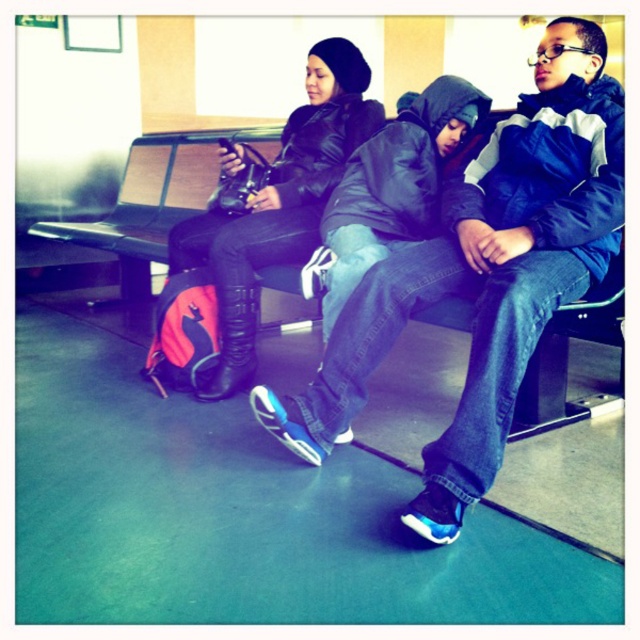
Is point (337, 406) farther from viewer compared to point (136, 150)?

That is False.

What do you see at coordinates (484, 275) in the screenshot? I see `blue suede sneakers at center` at bounding box center [484, 275].

Is point (509, 204) positioned behind point (120, 198)?

No, (509, 204) is closer to viewer.

This screenshot has width=640, height=640. In order to click on blue suede sneakers at center in this screenshot , I will do `click(484, 275)`.

Does black leather jacket at center have a lesser height compared to metallic gray bench at center?

No, black leather jacket at center is not shorter than metallic gray bench at center.

This screenshot has height=640, width=640. I want to click on black leather jacket at center, so click(278, 204).

Where is `black leather jacket at center`? black leather jacket at center is located at coordinates (278, 204).

Does blue suede sneakers at center appear on the right side of black leather jacket at center?

Correct, you'll find blue suede sneakers at center to the right of black leather jacket at center.

Is blue suede sneakers at center bigger than black leather jacket at center?

Indeed, blue suede sneakers at center has a larger size compared to black leather jacket at center.

This screenshot has height=640, width=640. Describe the element at coordinates (484, 275) in the screenshot. I see `blue suede sneakers at center` at that location.

This screenshot has height=640, width=640. In order to click on blue suede sneakers at center in this screenshot , I will do `click(484, 275)`.